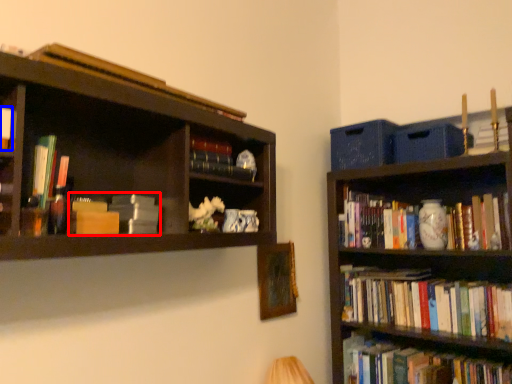
Question: Which of the following is the farthest to the observer, book (highlighted by a red box) or book (highlighted by a blue box)?

Choices:
 (A) book
 (B) book

Answer: (A)